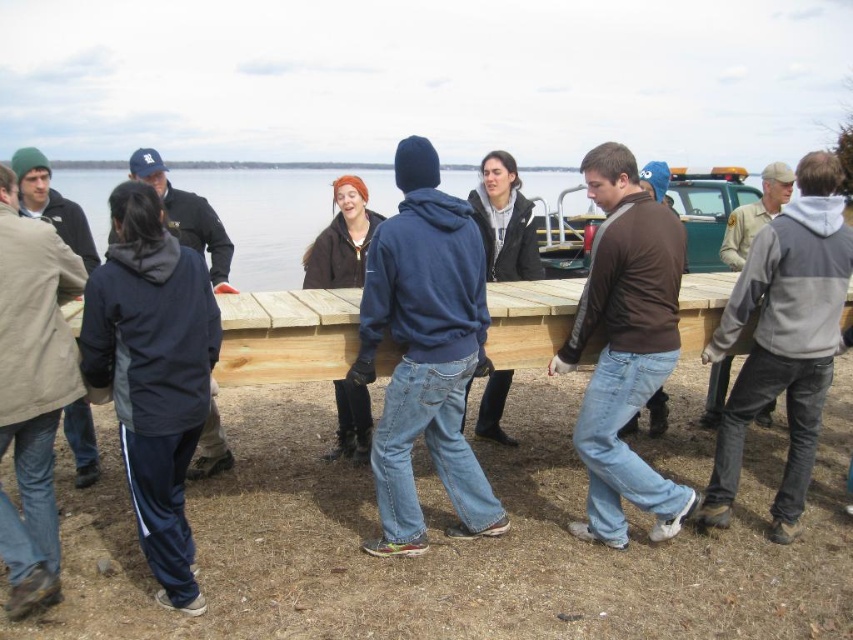
You are part of a group constructing a wooden platform near a lake. You need to hand a tool to the person wearing the dark gray fleece jacket at center and the person in the khaki uniform shirt at right. Which direction should you move to reach each person first?

To reach the dark gray fleece jacket at center first, move towards the left since it is positioned to the left of the khaki uniform shirt at right.

You are a photographer trying to capture a photo of the dark gray fleece jacket at center and the khaki uniform shirt at right. From the photographer perspective, which one is positioned lower in the image?

The dark gray fleece jacket at center is below the khaki uniform shirt at right, so it is positioned lower in the image.